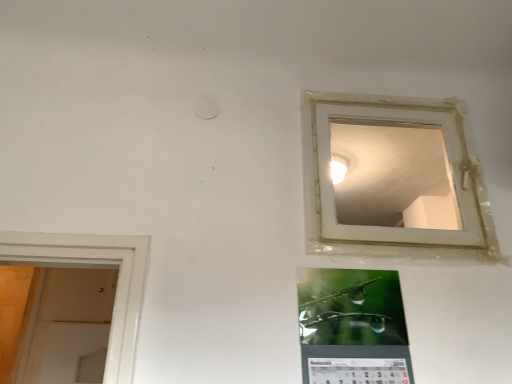
Question: Is green glossy calendar at lower center wider or thinner than transparent plastic window at upper right?

Choices:
 (A) wide
 (B) thin

Answer: (A)

Question: Which is correct: green glossy calendar at lower center is inside transparent plastic window at upper right, or outside of it?

Choices:
 (A) inside
 (B) outside

Answer: (B)

Question: From a real-world perspective, is green glossy calendar at lower center physically located above or below transparent plastic window at upper right?

Choices:
 (A) below
 (B) above

Answer: (A)

Question: Looking at the image, does transparent plastic window at upper right seem bigger or smaller compared to green glossy calendar at lower center?

Choices:
 (A) big
 (B) small

Answer: (A)

Question: Choose the correct answer: Is transparent plastic window at upper right inside green glossy calendar at lower center or outside it?

Choices:
 (A) inside
 (B) outside

Answer: (B)

Question: From a real-world perspective, is transparent plastic window at upper right above or below green glossy calendar at lower center?

Choices:
 (A) above
 (B) below

Answer: (A)

Question: Is transparent plastic window at upper right to the left or to the right of green glossy calendar at lower center in the image?

Choices:
 (A) left
 (B) right

Answer: (B)